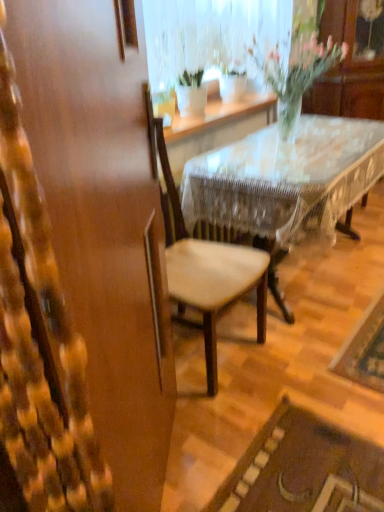
The image size is (384, 512). What do you see at coordinates (207, 270) in the screenshot?
I see `wooden chair at center` at bounding box center [207, 270].

This screenshot has width=384, height=512. Describe the element at coordinates (298, 63) in the screenshot. I see `translucent glass vase at upper center` at that location.

Identify the location of wooden lace-covered table at center. (286, 181).

I want to click on desk that appears in front of the translucent glass vase at upper center, so click(x=286, y=181).

Is translucent glass vase at upper center facing towards wooden lace-covered table at center?

No, translucent glass vase at upper center is not aimed at wooden lace-covered table at center.

From the image's perspective, between translucent glass vase at upper center and wooden lace-covered table at center, who is located below?

wooden lace-covered table at center appears lower in the image.

Considering the sizes of objects translucent glass vase at upper center and wooden lace-covered table at center in the image provided, who is smaller, translucent glass vase at upper center or wooden lace-covered table at center?

translucent glass vase at upper center.

Which object is positioned more to the left, translucent glass vase at upper center or wooden chair at center?

wooden chair at center is more to the left.

Is translucent glass vase at upper center in contact with wooden chair at center?

No, translucent glass vase at upper center is not next to wooden chair at center.

Is translucent glass vase at upper center outside of wooden chair at center?

Yes, translucent glass vase at upper center is outside of wooden chair at center.

From the image's perspective, does translucent glass vase at upper center appear lower than wooden chair at center?

Actually, translucent glass vase at upper center appears above wooden chair at center in the image.

Which object is closer to the camera, wooden lace-covered table at center or wooden chair at center?

wooden chair at center is in front.

Which of these two, wooden lace-covered table at center or wooden chair at center, stands shorter?

Standing shorter between the two is wooden lace-covered table at center.

Does wooden lace-covered table at center contain wooden chair at center?

That's incorrect, wooden chair at center is not inside wooden lace-covered table at center.

Can you confirm if wooden lace-covered table at center is positioned to the left of wooden chair at center?

In fact, wooden lace-covered table at center is to the right of wooden chair at center.

From a real-world perspective, is wooden chair at center positioned over wooden lace-covered table at center based on gravity?

Indeed, from a real-world perspective, wooden chair at center stands above wooden lace-covered table at center.

Can you tell me how much wooden chair at center and wooden lace-covered table at center differ in facing direction?

The angular difference between wooden chair at center and wooden lace-covered table at center is 0.376 degrees.

Considering the sizes of objects wooden chair at center and wooden lace-covered table at center in the image provided, who is taller, wooden chair at center or wooden lace-covered table at center?

Standing taller between the two is wooden chair at center.

Would you say wooden chair at center is a long distance from wooden lace-covered table at center?

wooden chair at center is actually quite close to wooden lace-covered table at center.

Between wooden lace-covered table at center and translucent glass vase at upper center, which one appears on the right side from the viewer's perspective?

wooden lace-covered table at center is more to the right.

Can you tell me how much wooden lace-covered table at center and translucent glass vase at upper center differ in facing direction?

The angle between the facing direction of wooden lace-covered table at center and the facing direction of translucent glass vase at upper center is 0.839 degrees.

Based on the photo, from a real-world perspective, which is physically above, wooden lace-covered table at center or translucent glass vase at upper center?

From a 3D spatial view, translucent glass vase at upper center is above.

Is wooden chair at center looking in the opposite direction of translucent glass vase at upper center?

No, wooden chair at center's orientation is not away from translucent glass vase at upper center.

Can translucent glass vase at upper center be found inside wooden chair at center?

No, translucent glass vase at upper center is located outside of wooden chair at center.

Based on their sizes in the image, would you say wooden chair at center is bigger or smaller than translucent glass vase at upper center?

Considering their sizes, wooden chair at center takes up more space than translucent glass vase at upper center.

The width and height of the screenshot is (384, 512). What are the coordinates of `houseplant positioned vertically above the wooden lace-covered table at center (from a real-world perspective)` in the screenshot? It's located at (298, 63).

At what (x,y) coordinates should I click in order to perform the action: click on houseplant that is above the wooden chair at center (from the image's perspective). Please return your answer as a coordinate pair (x, y). The width and height of the screenshot is (384, 512). Looking at the image, I should click on (298, 63).

Looking at the image, which one is located closer to translucent glass vase at upper center, wooden lace-covered table at center or wooden chair at center?

Based on the image, wooden lace-covered table at center appears to be nearer to translucent glass vase at upper center.

Looking at this image, from the image, which object appears to be farther from wooden chair at center, wooden lace-covered table at center or translucent glass vase at upper center?

translucent glass vase at upper center lies further to wooden chair at center than the other object.

From the picture: Which object lies further to the anchor point wooden chair at center, translucent glass vase at upper center or wooden lace-covered table at center?

translucent glass vase at upper center is further to wooden chair at center.

Consider the image. Which object lies nearer to the anchor point translucent glass vase at upper center, wooden chair at center or wooden lace-covered table at center?

Among the two, wooden lace-covered table at center is located nearer to translucent glass vase at upper center.

When comparing their distances from wooden lace-covered table at center, does translucent glass vase at upper center or wooden chair at center seem further?

translucent glass vase at upper center.

Looking at this image, when comparing their distances from wooden lace-covered table at center, does wooden chair at center or translucent glass vase at upper center seem further?

translucent glass vase at upper center is positioned further to the anchor wooden lace-covered table at center.

I want to click on desk between translucent glass vase at upper center and wooden chair at center in the vertical direction, so click(286, 181).